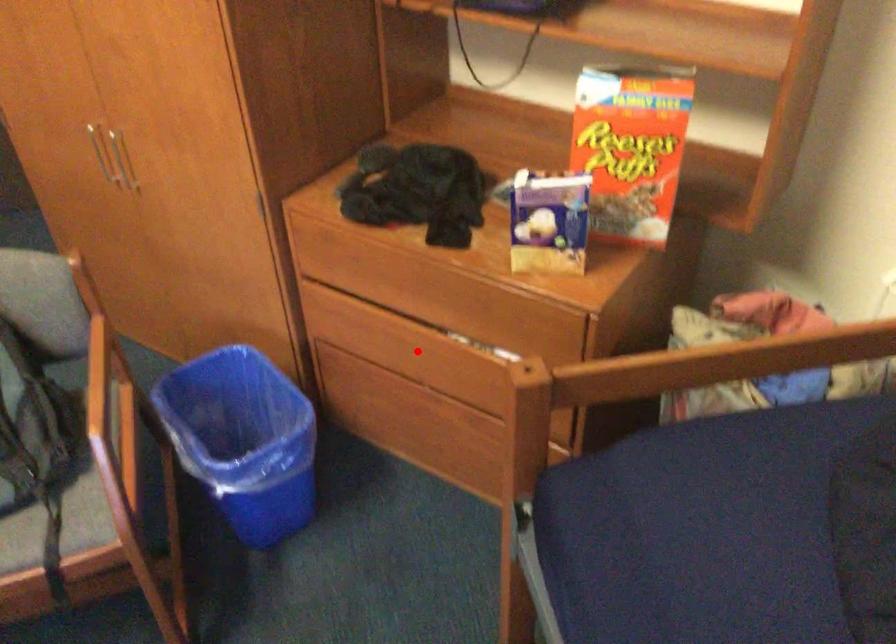
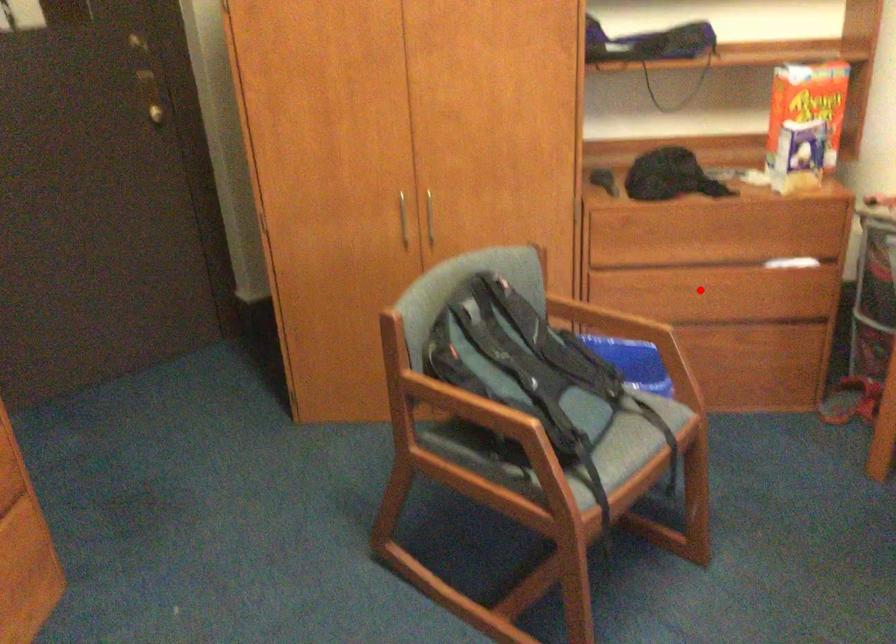
I am providing you with two images of the same scene from different viewpoints. A red point is marked on the first image and another point is marked on the second image. Do the highlighted points in image1 and image2 indicate the same real-world spot?

Yes